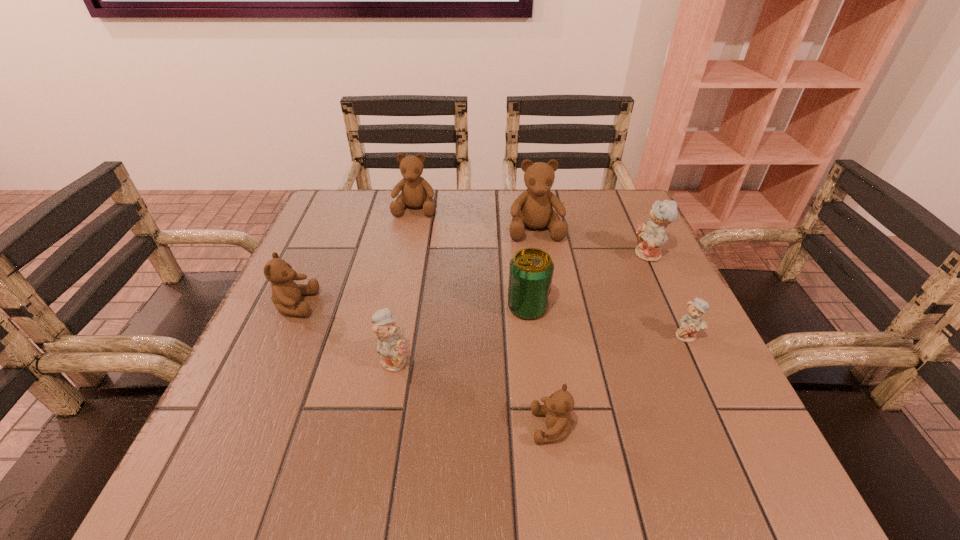
Locate an element on the screen. the tallest object is located at coordinates (532, 208).

Locate an element on the screen. The image size is (960, 540). the tallest teddy bear is located at coordinates (532, 208).

Identify the location of the third brown teddy bear from right to left. (416, 192).

You are a GUI agent. You are given a task and a screenshot of the screen. Output one action in this format:
    pyautogui.click(x=<x>, y=<y>)
    Task: Click on the farthest blue teddy bear
    This screenshot has height=540, width=960.
    Given the screenshot: What is the action you would take?
    click(652, 235)

Locate an element on the screen. The height and width of the screenshot is (540, 960). green beer can is located at coordinates (531, 270).

Find the location of a particular element. The height and width of the screenshot is (540, 960). the second smallest blue teddy bear is located at coordinates (390, 345).

This screenshot has height=540, width=960. I want to click on the nearest blue teddy bear, so tap(390, 345).

Locate an element on the screen. the leftmost brown teddy bear is located at coordinates (286, 294).

What are the coordinates of `the third biggest brown teddy bear` in the screenshot? It's located at (286, 294).

The image size is (960, 540). I want to click on the fifth farthest teddy bear, so click(x=693, y=321).